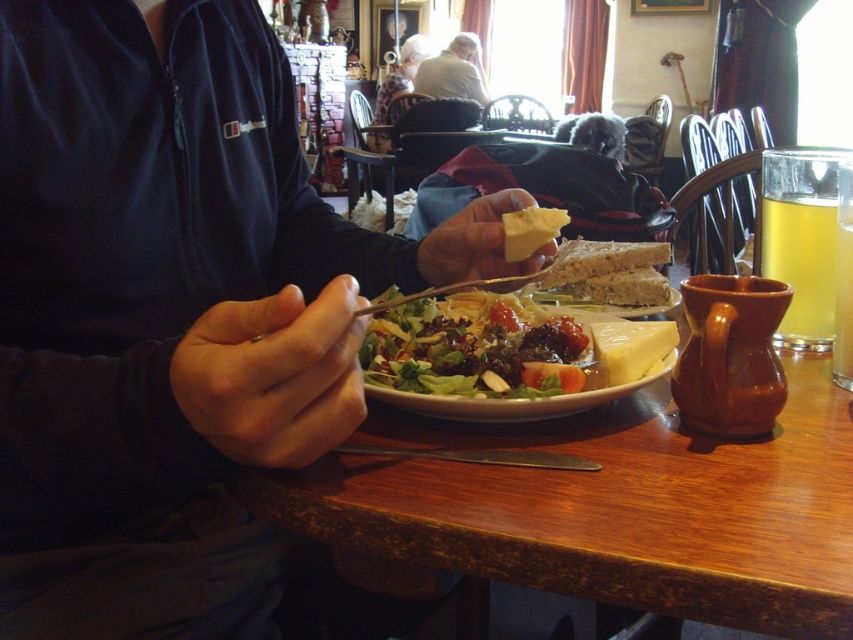
Question: Can you confirm if white hair at upper center is bigger than yellow cheese at center?

Choices:
 (A) yes
 (B) no

Answer: (A)

Question: Which point appears farthest from the camera in this image?

Choices:
 (A) (653, 326)
 (B) (270, 310)
 (C) (434, 61)
 (D) (512, 227)

Answer: (C)

Question: Is yellow creamy cheese at plate center below yellow cheese at center?

Choices:
 (A) yes
 (B) no

Answer: (A)

Question: Which object is the closest to the yellow creamy cheese at plate center?

Choices:
 (A) yellow cheese at center
 (B) wooden table at center
 (C) white hair at upper center
 (D) fresh green salad at center

Answer: (D)

Question: Which object is the closest to the matte black jacket at center?

Choices:
 (A) fresh green salad at center
 (B) translucent glass mug at upper right
 (C) yellow creamy cheese at plate center
 (D) white hair at upper center

Answer: (A)

Question: Does matte black jacket at center have a larger size compared to fresh green salad at center?

Choices:
 (A) yes
 (B) no

Answer: (A)